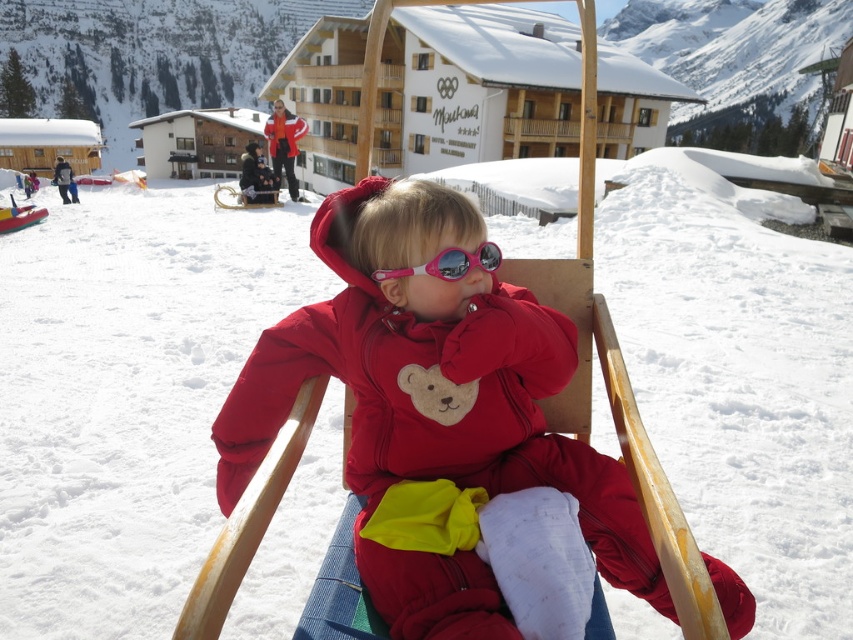
What is located at the coordinates point (432, 404) in the image?

The point (432, 404) is where the matte red snowsuit at center is located.

You are a photographer trying to capture both the matte red snowsuit at center and the matte red jacket at upper center in a single shot. Based on their sizes, which one should you focus on to ensure both are clearly visible in the frame?

The matte red snowsuit at center is smaller than the matte red jacket at upper center. To ensure both are clearly visible, focus on the matte red jacket at upper center since it is larger and will be easier to capture in the frame while the smaller snowsuit remains in view.